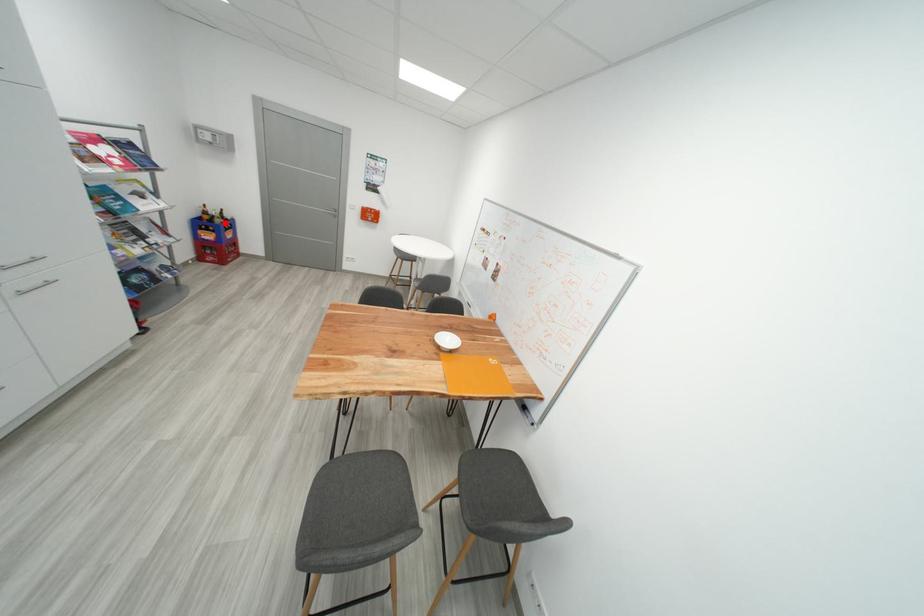
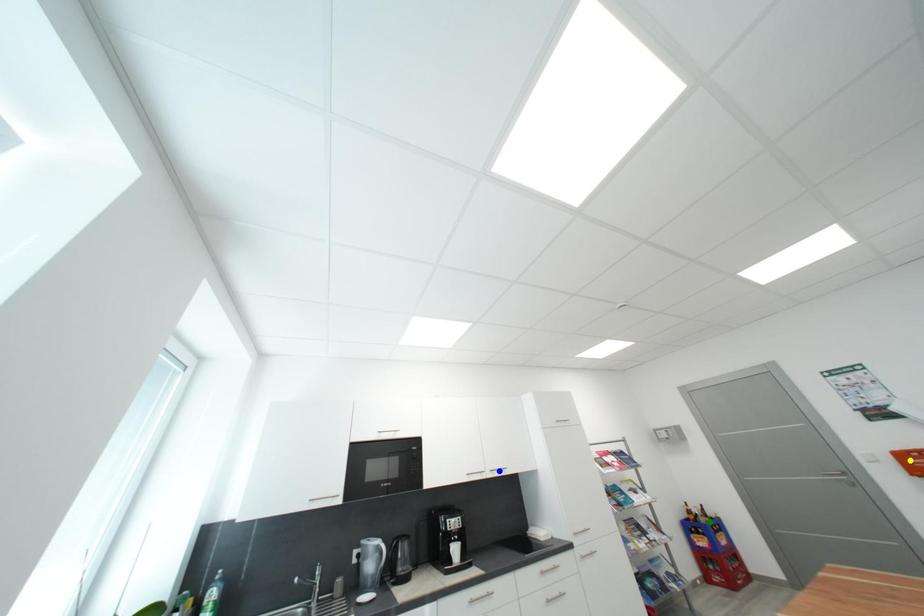
Question: I am providing you with two images of the same scene from different viewpoints. A red point is marked on the first image. You are given multiple points on the second image. Which mark in image 2 goes with the point in image 1?

Choices:
 (A) green point
 (B) blue point
 (C) yellow point

Answer: (A)